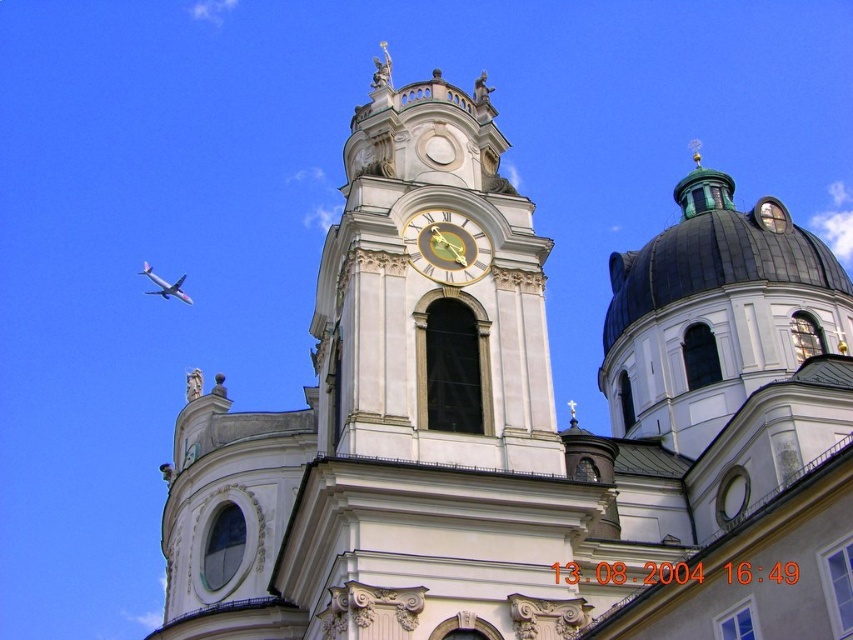
Question: Among these objects, which one is nearest to the camera?

Choices:
 (A) metallic silver airplane at upper left
 (B) white stone clock tower at center

Answer: (B)

Question: Which point is farther to the camera?

Choices:
 (A) metallic silver airplane at upper left
 (B) goldmetallicclock at upper center

Answer: (A)

Question: Is goldmetallicclock at upper center wider than metallic silver airplane at upper left?

Choices:
 (A) no
 (B) yes

Answer: (A)

Question: Can you confirm if white stone clock tower at center is bigger than goldmetallicclock at upper center?

Choices:
 (A) yes
 (B) no

Answer: (A)

Question: Which is farther from the white stone clock tower at center?

Choices:
 (A) goldmetallicclock at upper center
 (B) metallic silver airplane at upper left

Answer: (B)

Question: Can you confirm if goldmetallicclock at upper center is positioned above metallic silver airplane at upper left?

Choices:
 (A) no
 (B) yes

Answer: (A)